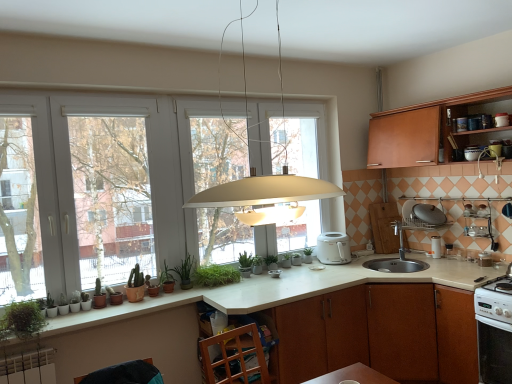
Identify the location of vacant area that is situated to the right of matte brown pot at lower left, which ranks as the fifth plant in right-to-left order. Image resolution: width=512 pixels, height=384 pixels. (97, 304).